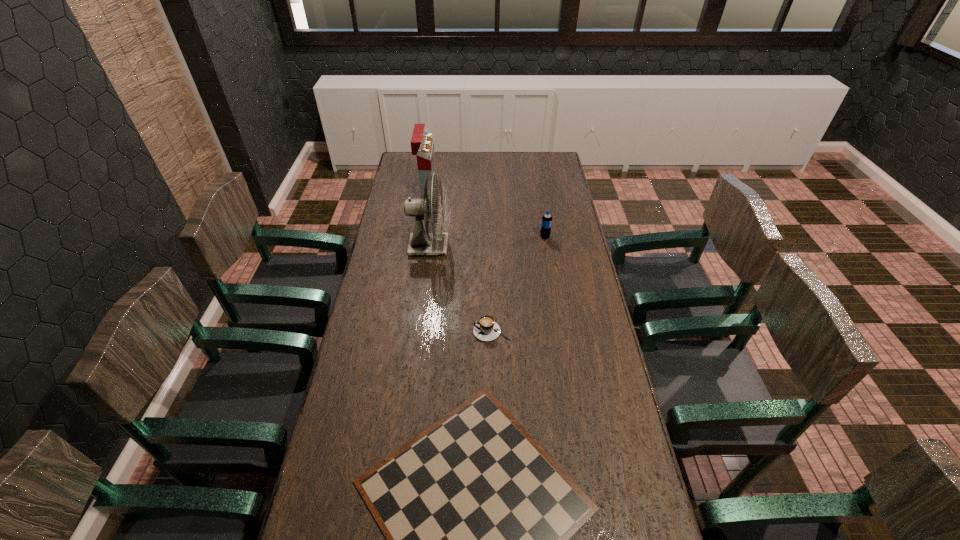
Where is `fan`? This screenshot has width=960, height=540. fan is located at coordinates (421, 242).

Identify the location of the fourth shortest object. The width and height of the screenshot is (960, 540). (422, 145).

Find the location of a particular element. cigarette case is located at coordinates (422, 145).

You are a GUI agent. You are given a task and a screenshot of the screen. Output one action in this format:
    pyautogui.click(x=<x>, y=<y>)
    Task: Click on the soda bottle
    
    Given the screenshot: What is the action you would take?
    pyautogui.click(x=546, y=224)

Locate an element on the screen. Image resolution: width=960 pixels, height=540 pixels. the second nearest object is located at coordinates (486, 329).

Find the location of a particular element. free space located 0.340m on the front-facing side of the fan is located at coordinates (528, 247).

The image size is (960, 540). I want to click on vacant space located 0.190m with the lid open on the fourth shortest object, so click(473, 188).

Where is `vacant space positioned 0.120m on the back of the third shortest object`? vacant space positioned 0.120m on the back of the third shortest object is located at coordinates (541, 218).

You are a GUI agent. You are given a task and a screenshot of the screen. Output one action in this format:
    pyautogui.click(x=<x>, y=<y>)
    Task: Click on the blank space located 0.140m with the handle on the side of the cappuccino
    The image size is (960, 540).
    Given the screenshot: What is the action you would take?
    pyautogui.click(x=433, y=332)

Identify the location of free location located with the handle on the side of the cappuccino. The image size is (960, 540). (359, 332).